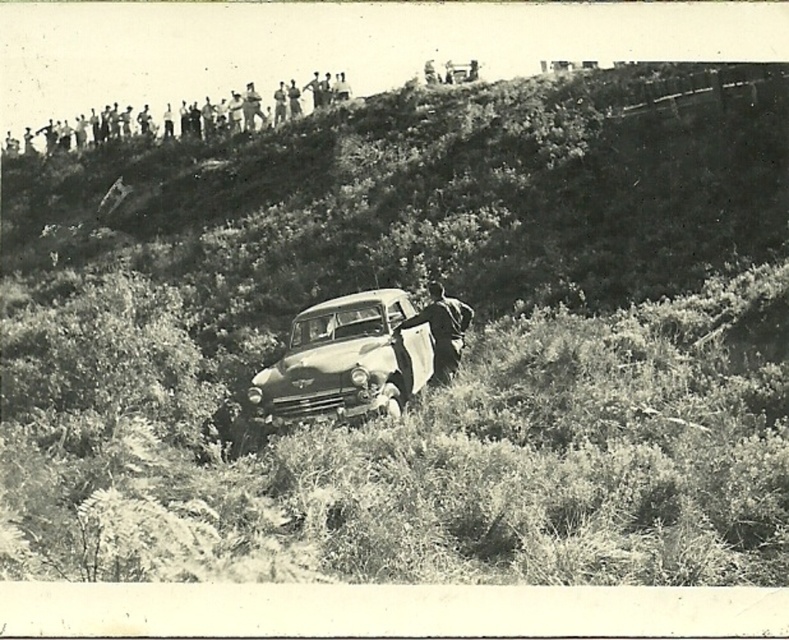
Which of these two, shiny silver sedan at center or metallic silver pickup truck at center, stands shorter?

metallic silver pickup truck at center

The height and width of the screenshot is (640, 789). What do you see at coordinates (346, 362) in the screenshot? I see `shiny silver sedan at center` at bounding box center [346, 362].

Find the location of a particular element. shiny silver sedan at center is located at coordinates (346, 362).